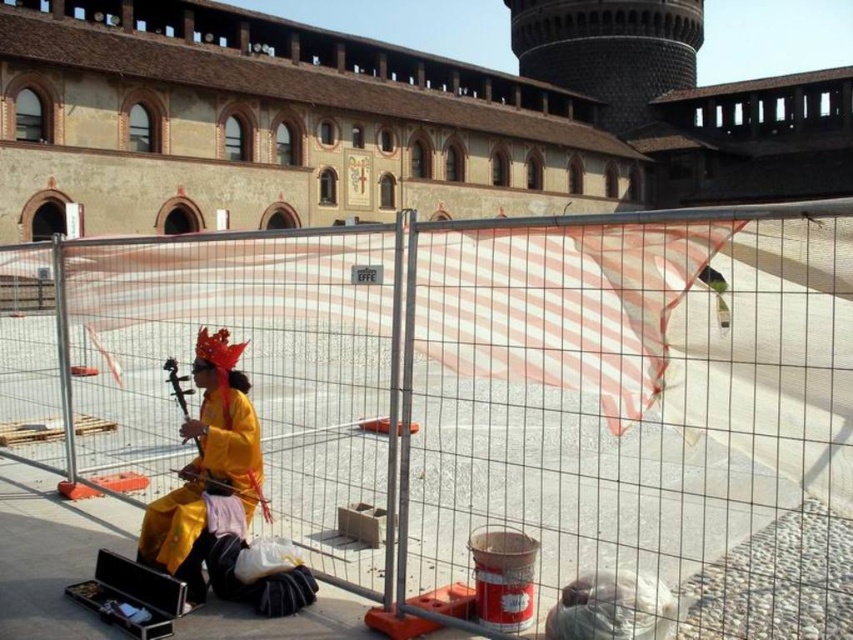
You are standing in the outdoor scene and want to approach the person playing the instrument. The metal fence at center is in your way. Can you walk around it? Please explain your reasoning based on its position.

The metal fence at center is positioned at coordinates 0.625 on the x axis and 0.570 on the y axis. Since fences typically have gaps between their posts or rails, it might be possible to walk around it depending on its physical structure. However, without additional information about the fence design, we can only confirm its central location obstructing the path.